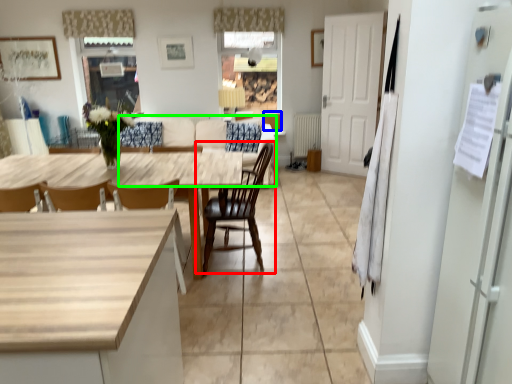
Question: Based on their relative distances, which object is farther from chair (highlighted by a red box)? Choose from cabinetry (highlighted by a blue box) and couch (highlighted by a green box).

Choices:
 (A) cabinetry
 (B) couch

Answer: (A)